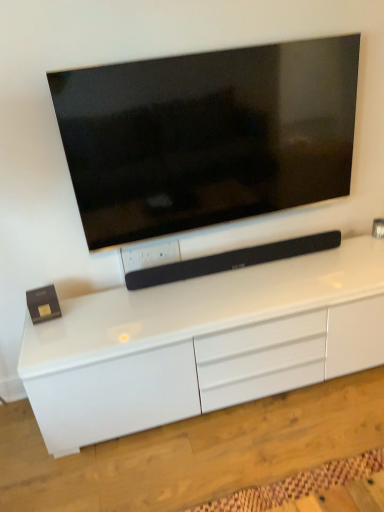
Question: Is white glossy cabinet at center in front of or behind matte black tv at upper center in the image?

Choices:
 (A) front
 (B) behind

Answer: (A)

Question: Is point (251, 376) closer or farther from the camera than point (185, 55)?

Choices:
 (A) farther
 (B) closer

Answer: (A)

Question: Considering the real-world distances, which object is closest to the white glossy cabinet at center?

Choices:
 (A) matte black tv at upper center
 (B) black matte soundbar at center

Answer: (B)

Question: Based on their relative distances, which object is farther from the white glossy cabinet at center?

Choices:
 (A) black matte soundbar at center
 (B) matte black tv at upper center

Answer: (B)